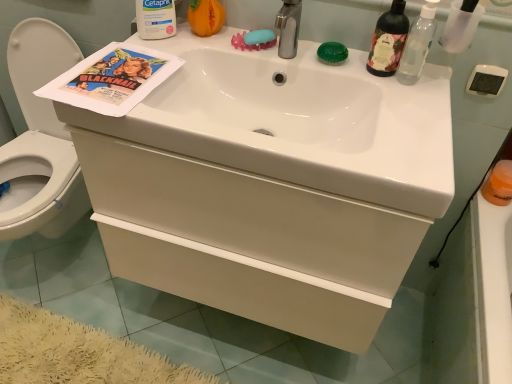
Locate an element on the screen. The height and width of the screenshot is (384, 512). vacant space to the right of green translucent soap at upper center, the second soap viewed from the left is located at coordinates (389, 73).